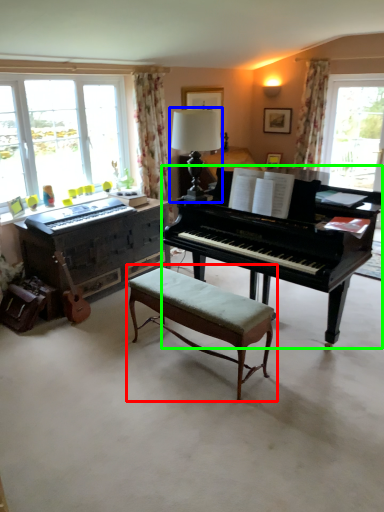
Question: Considering the real-world distances, which object is closest to table (highlighted by a red box)? table lamp (highlighted by a blue box) or piano (highlighted by a green box).

Choices:
 (A) table lamp
 (B) piano

Answer: (B)